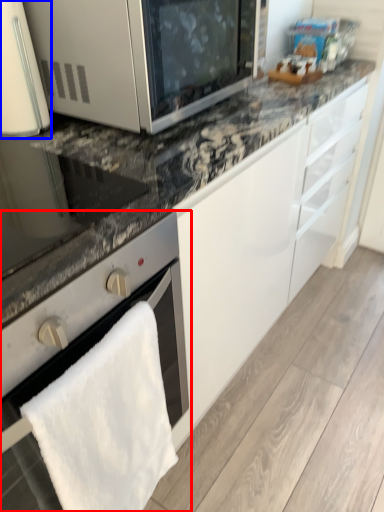
Question: Which of the following is the closest to the observer, oven (highlighted by a red box) or home appliance (highlighted by a blue box)?

Choices:
 (A) oven
 (B) home appliance

Answer: (A)